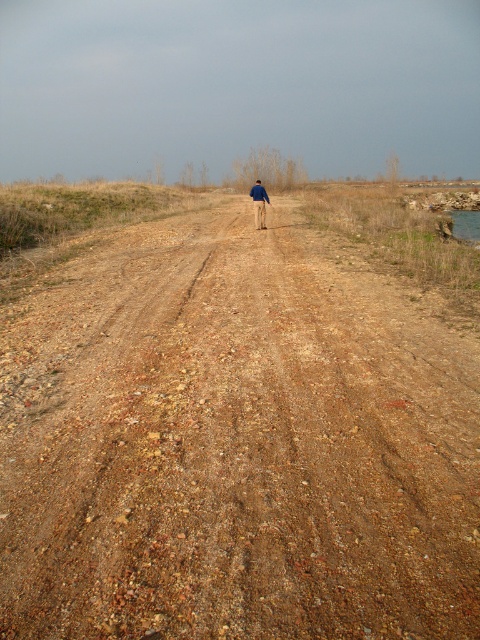
Does brown gravel dirt track at center have a greater height compared to blue denim jacket at center?

No, brown gravel dirt track at center is not taller than blue denim jacket at center.

Who is more distant from viewer, (350, 545) or (269, 204)?

Point (269, 204)

Locate an element on the screen. The image size is (480, 640). brown gravel dirt track at center is located at coordinates (236, 442).